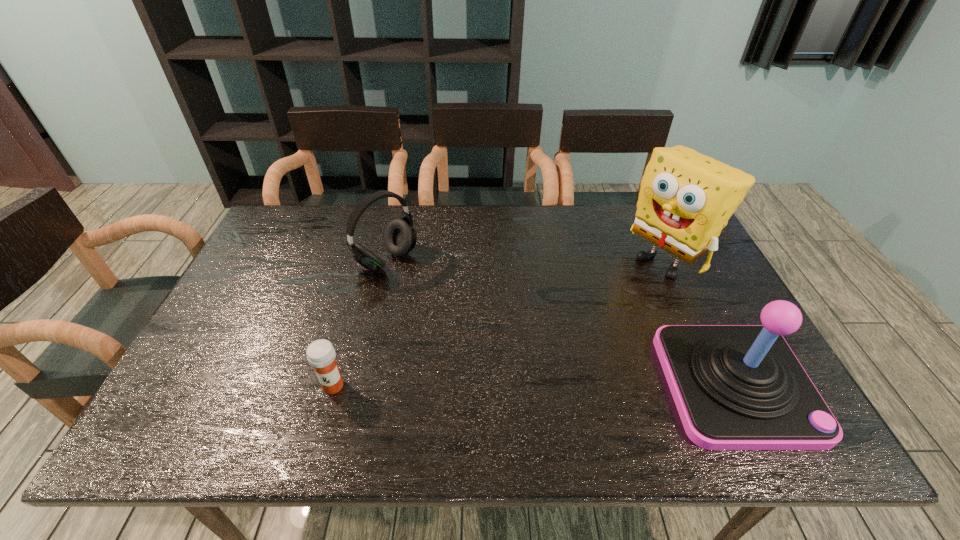
Identify the location of free space between the joystick and the headset. The image size is (960, 540). (561, 323).

Where is `free space between the medicine and the tallest object`? free space between the medicine and the tallest object is located at coordinates (500, 323).

At what (x,y) coordinates should I click in order to perform the action: click on free spot between the tallest object and the shortest object. Please return your answer as a coordinate pair (x, y). The height and width of the screenshot is (540, 960). Looking at the image, I should click on (500, 323).

Locate which object is the third closest to the sponge. Please provide its 2D coordinates. Your answer should be formatted as a tuple, i.e. [(x, y)], where the tuple contains the x and y coordinates of a point satisfying the conditions above.

[(321, 355)]

I want to click on object that can be found as the second closest to the tallest object, so click(x=400, y=237).

This screenshot has height=540, width=960. Find the location of `vacant position in the image that satisfies the following two spatial constraints: 1. on the back side of the sponge; 2. on the left side of the headset`. vacant position in the image that satisfies the following two spatial constraints: 1. on the back side of the sponge; 2. on the left side of the headset is located at coordinates (386, 260).